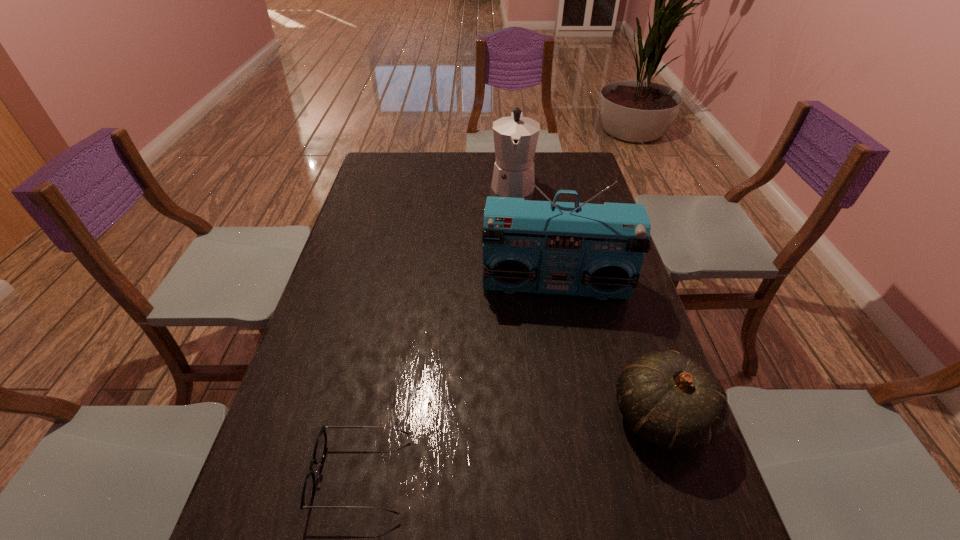
Locate an element on the screen. Image resolution: width=960 pixels, height=540 pixels. vacant space that satisfies the following two spatial constraints: 1. on the front side of the gourd; 2. on the right side of the coffeepot is located at coordinates (537, 418).

Where is `free point that satisfies the following two spatial constraints: 1. on the front side of the gourd; 2. on the left side of the third nearest object`? Image resolution: width=960 pixels, height=540 pixels. free point that satisfies the following two spatial constraints: 1. on the front side of the gourd; 2. on the left side of the third nearest object is located at coordinates (578, 418).